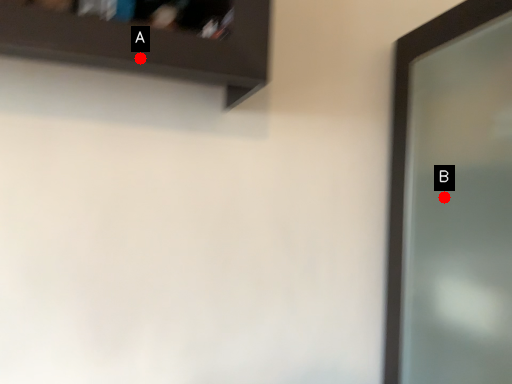
Question: Two points are circled on the image, labeled by A and B beside each circle. Which point is closer to the camera?

Choices:
 (A) A is closer
 (B) B is closer

Answer: (A)